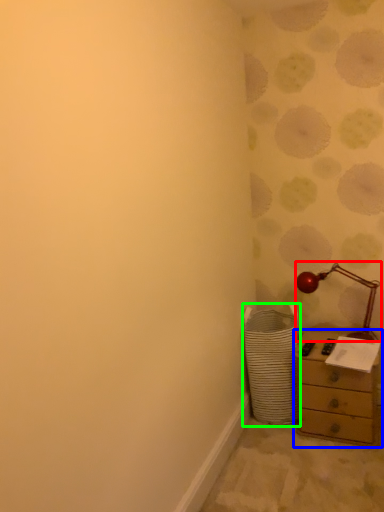
Question: Which object is the farthest from table lamp (highlighted by a red box)? Choose among these: chest of drawers (highlighted by a blue box) or laundry basket (highlighted by a green box).

Choices:
 (A) chest of drawers
 (B) laundry basket

Answer: (B)